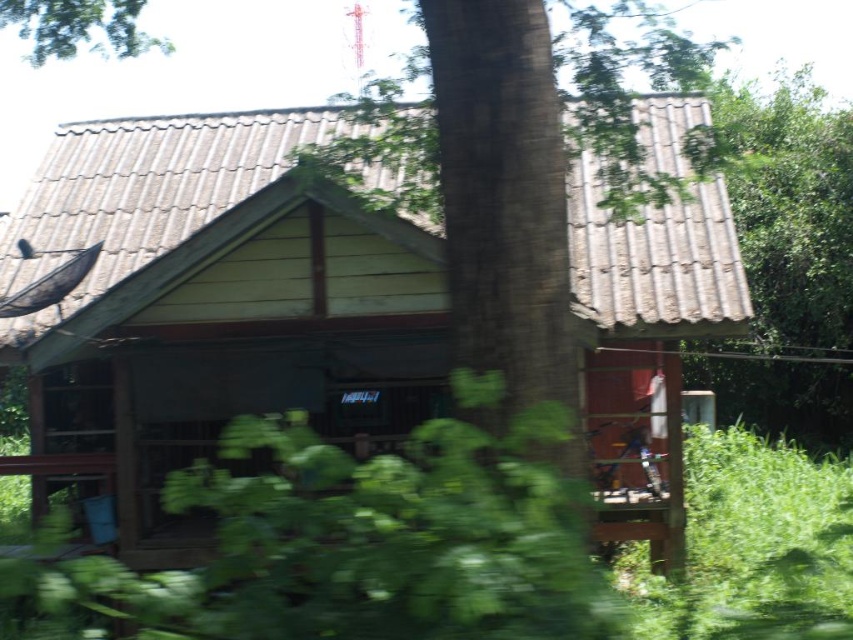
You are standing in front of the rustic wooden structure and see a green leafy plant at center and a green leafy tree at upper right. Which one is more to the left?

The green leafy plant at center is more to the left because it is positioned on the left side of the green leafy tree at upper right.

You are standing in front of the wooden cabin at center and the green leafy plant at center. Which object has a narrower width?

The wooden cabin at center is thinner than the green leafy plant at center, so the wooden cabin at center has a narrower width.